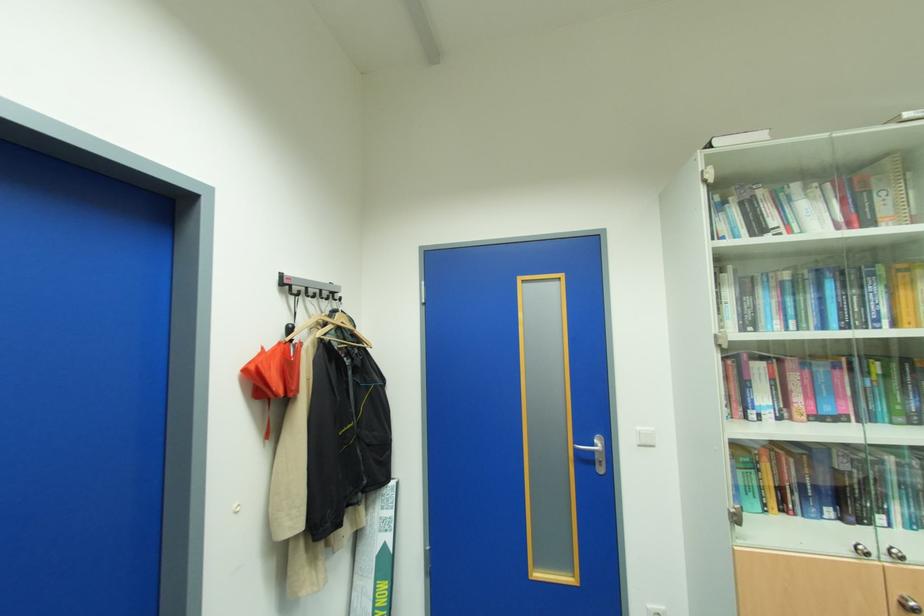
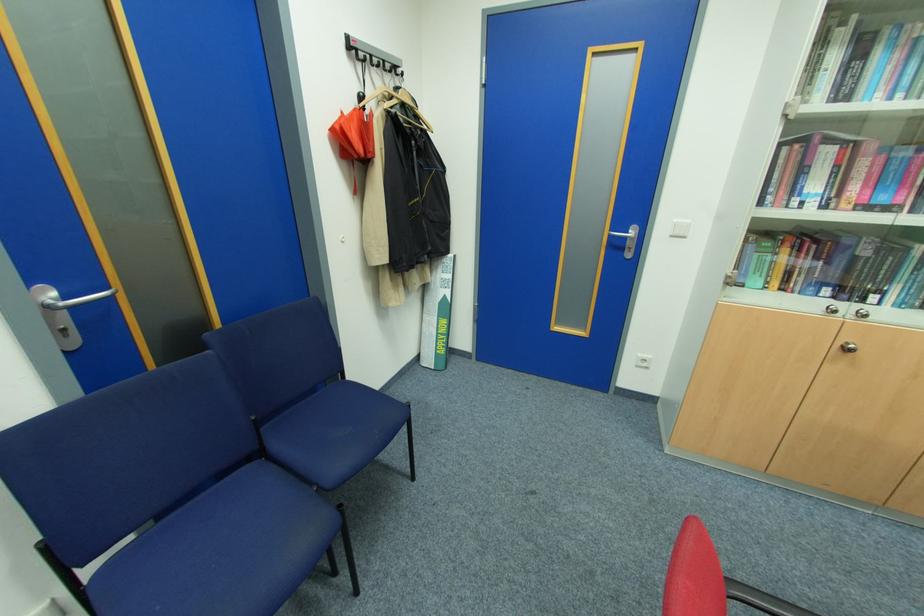
Find the pixel in the second image that matches (597,445) in the first image.

(630, 233)